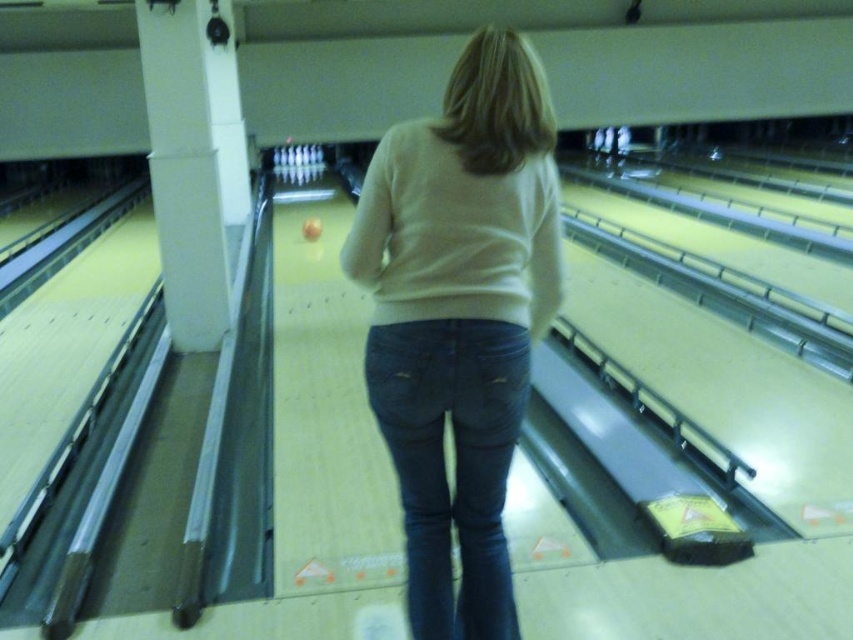
Question: Is light beige sweater at center positioned before dark blue denim jeans at center?

Choices:
 (A) yes
 (B) no

Answer: (B)

Question: Which of the following is the farthest from the observer?

Choices:
 (A) dark blue denim jeans at center
 (B) light beige sweater at center

Answer: (B)

Question: Which point is closer to the camera taking this photo?

Choices:
 (A) (434, 323)
 (B) (415, 465)

Answer: (A)

Question: Which object is closer to the camera taking this photo?

Choices:
 (A) light beige sweater at center
 (B) dark blue denim jeans at center

Answer: (B)

Question: Is light beige sweater at center below dark blue denim jeans at center?

Choices:
 (A) yes
 (B) no

Answer: (B)

Question: Is light beige sweater at center smaller than dark blue denim jeans at center?

Choices:
 (A) yes
 (B) no

Answer: (B)